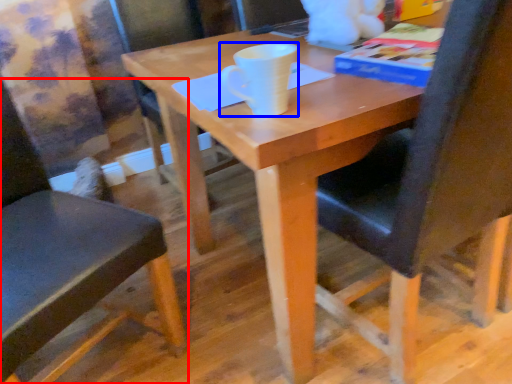
Question: Which object appears farthest to the camera in this image, chair (highlighted by a red box) or coffee cup (highlighted by a blue box)?

Choices:
 (A) chair
 (B) coffee cup

Answer: (B)